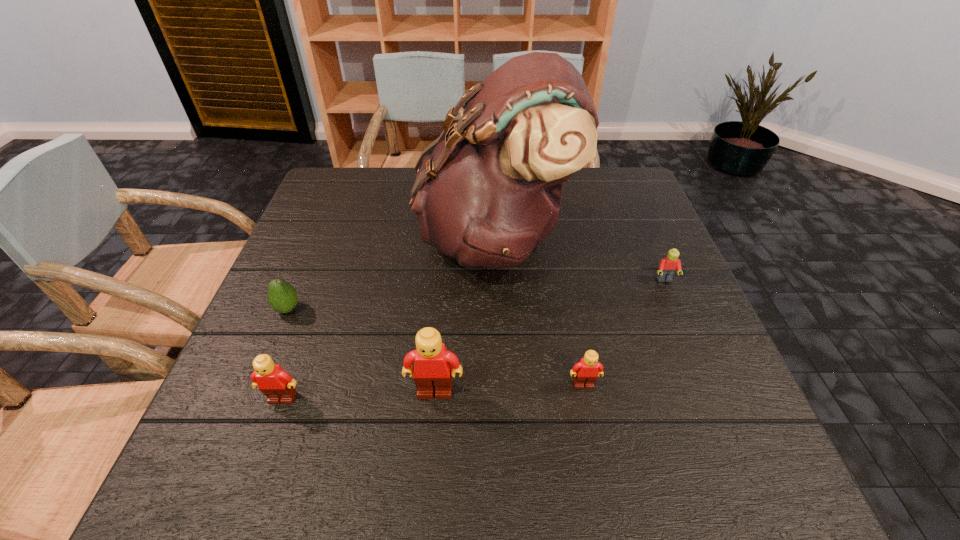
Identify the location of free space in the image that satisfies the following two spatial constraints: 1. at the front of the tallest object with buckles; 2. on the face of the third tallest object. (499, 398).

You are a GUI agent. You are given a task and a screenshot of the screen. Output one action in this format:
    pyautogui.click(x=<x>, y=<y>)
    Task: Click on the vacant space that satisfies the following two spatial constraints: 1. at the front of the satchel with buckles; 2. on the face of the second tallest object
    This screenshot has width=960, height=540.
    Given the screenshot: What is the action you would take?
    pyautogui.click(x=499, y=392)